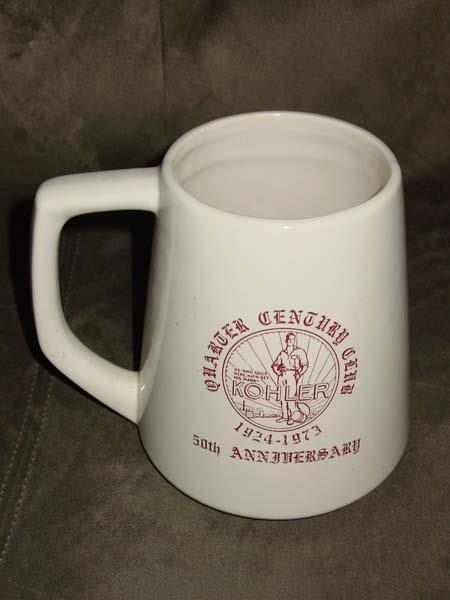
This screenshot has height=600, width=450. In order to click on white handle in this screenshot , I will do `click(82, 200)`, `click(47, 304)`, `click(96, 380)`.